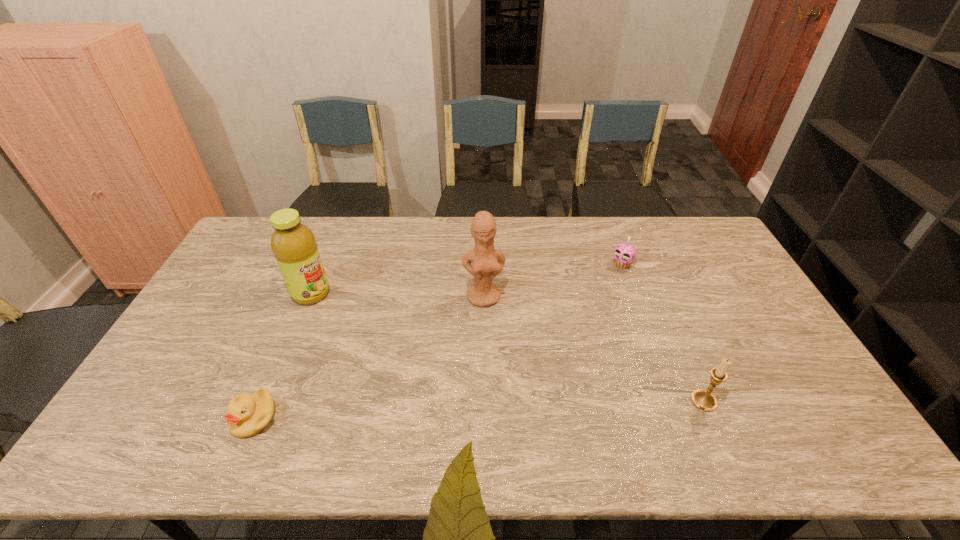
In the image, there is a desktop. Where is `free region at the near edge`? The image size is (960, 540). free region at the near edge is located at coordinates (401, 390).

In the image, there is a desktop. At what (x,y) coordinates should I click in order to perform the action: click on blank space at the left edge. Please return your answer as a coordinate pair (x, y). Looking at the image, I should click on [x=180, y=362].

The height and width of the screenshot is (540, 960). I want to click on free region at the right edge of the desktop, so click(x=758, y=341).

Locate an element on the screen. free space at the far right corner of the desktop is located at coordinates (694, 227).

The height and width of the screenshot is (540, 960). Find the location of `unoccupied position between the candle holder and the fruit juice`. unoccupied position between the candle holder and the fruit juice is located at coordinates (508, 347).

The image size is (960, 540). Find the location of `vacant area between the fruit juice and the duckling`. vacant area between the fruit juice and the duckling is located at coordinates (282, 355).

This screenshot has height=540, width=960. I want to click on empty space between the figurine and the third shortest object, so click(x=593, y=349).

The height and width of the screenshot is (540, 960). What are the coordinates of `free space between the cupcake and the rightmost object` in the screenshot? It's located at click(x=663, y=333).

Where is `vacant area between the shortest object and the fourth object from left to right`? The width and height of the screenshot is (960, 540). vacant area between the shortest object and the fourth object from left to right is located at coordinates (438, 341).

The width and height of the screenshot is (960, 540). In order to click on vacant area between the figurine and the fruit juice in this screenshot , I will do `click(397, 295)`.